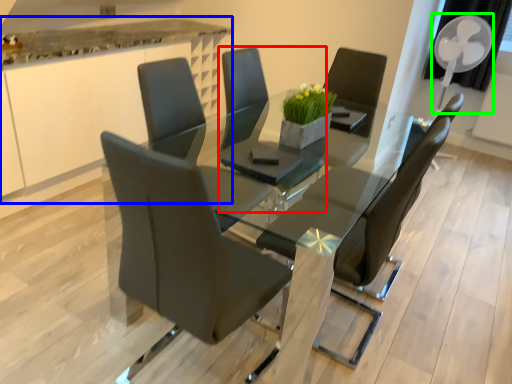
Question: Which object is positioned farthest from chair (highlighted by a red box)? Select from counter (highlighted by a blue box) and mechanical fan (highlighted by a green box).

Choices:
 (A) counter
 (B) mechanical fan

Answer: (B)